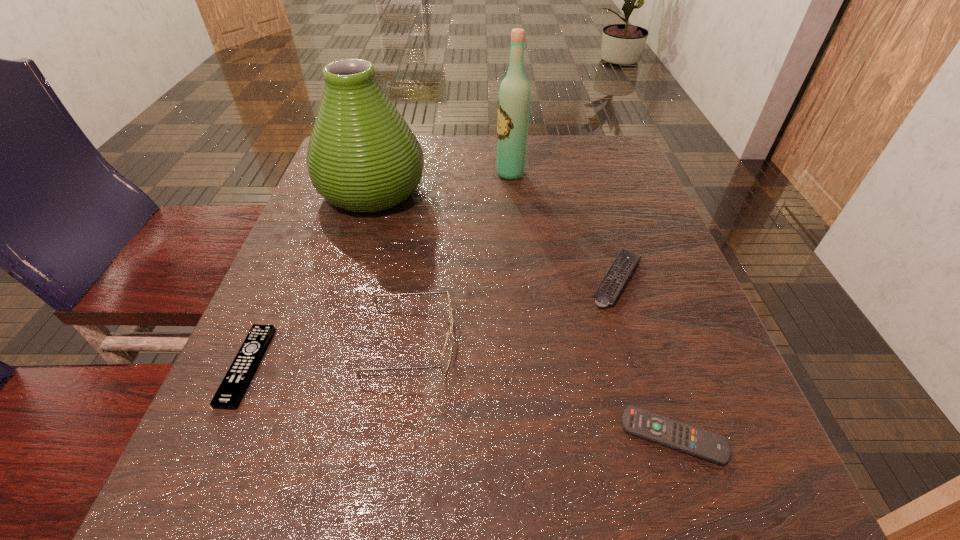
Where is `free space between the vase and the fourth shortest object`? Image resolution: width=960 pixels, height=540 pixels. free space between the vase and the fourth shortest object is located at coordinates (392, 265).

You are a GUI agent. You are given a task and a screenshot of the screen. Output one action in this format:
    pyautogui.click(x=<x>, y=<y>)
    Task: Click on the object that ranks as the fourth closest to the fourth shortest object
    The width and height of the screenshot is (960, 540).
    Given the screenshot: What is the action you would take?
    pyautogui.click(x=700, y=443)

Locate which object is the third closest to the wine bottle. Please provide its 2D coordinates. Your answer should be formatted as a tuple, i.e. [(x, y)], where the tuple contains the x and y coordinates of a point satisfying the conditions above.

[(447, 351)]

Locate which remote control is the third closest to the second tallest object. Please provide its 2D coordinates. Your answer should be formatted as a tuple, i.e. [(x, y)], where the tuple contains the x and y coordinates of a point satisfying the conditions above.

[(700, 443)]

Locate an element on the screen. Image resolution: width=960 pixels, height=540 pixels. the closest remote control to the second tallest object is located at coordinates (232, 388).

At what (x,y) coordinates should I click in order to perform the action: click on free space that satisfies the following two spatial constraints: 1. on the front-facing side of the fourth object from left to right; 2. on the right side of the tallest remote control. Please return your answer as a coordinate pair (x, y). The height and width of the screenshot is (540, 960). Looking at the image, I should click on (520, 280).

Locate an element on the screen. Image resolution: width=960 pixels, height=540 pixels. vacant region that satisfies the following two spatial constraints: 1. on the front-facing side of the wine bottle; 2. on the left side of the third shortest object is located at coordinates (520, 280).